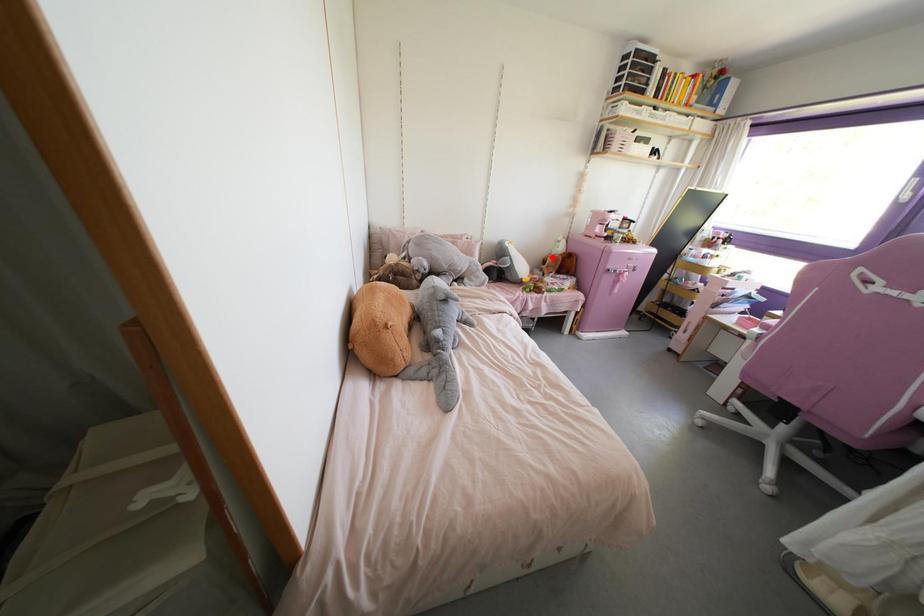
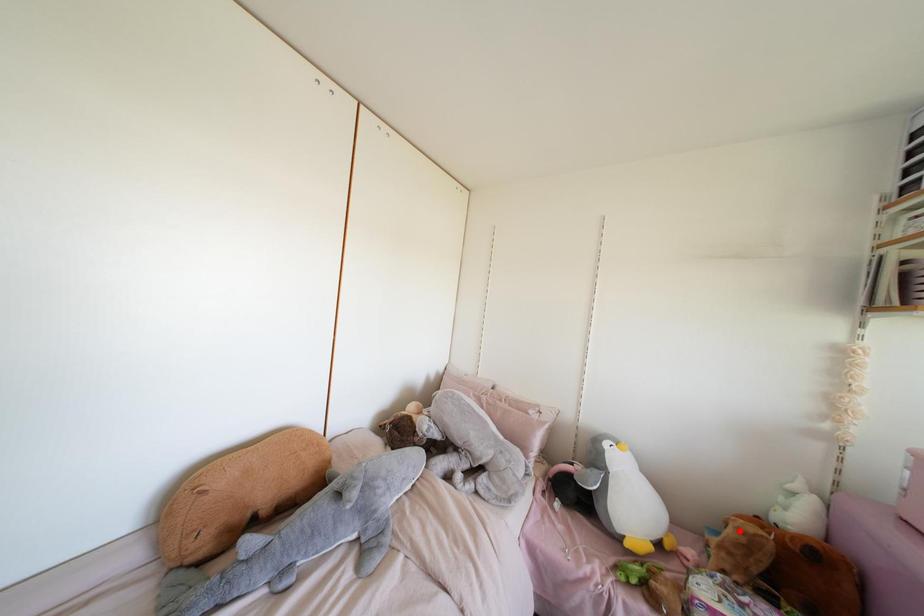
I am providing you with two images of the same scene from different viewpoints. A red point is marked on the first image and another point is marked on the second image. Do the highlighted points in image1 and image2 indicate the same real-world spot?

Yes